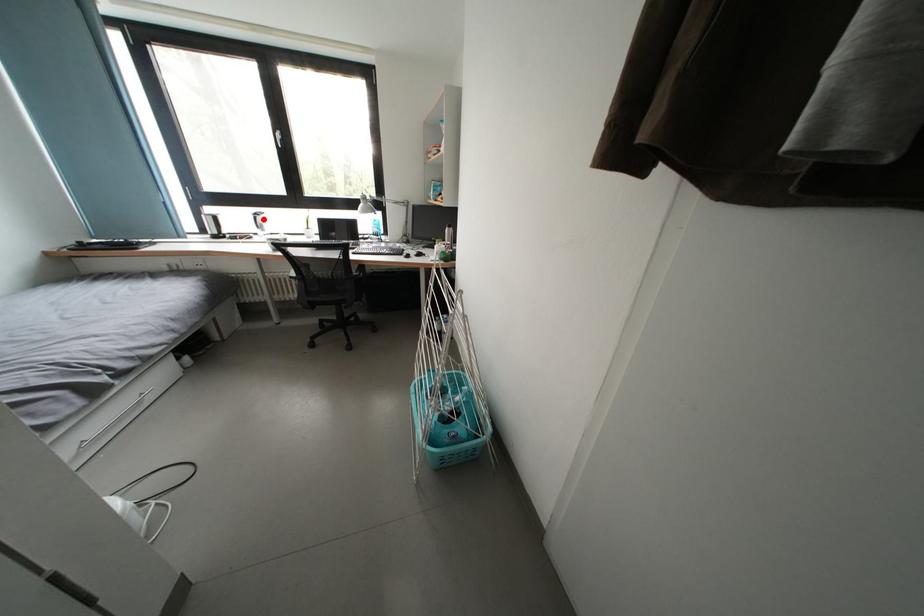
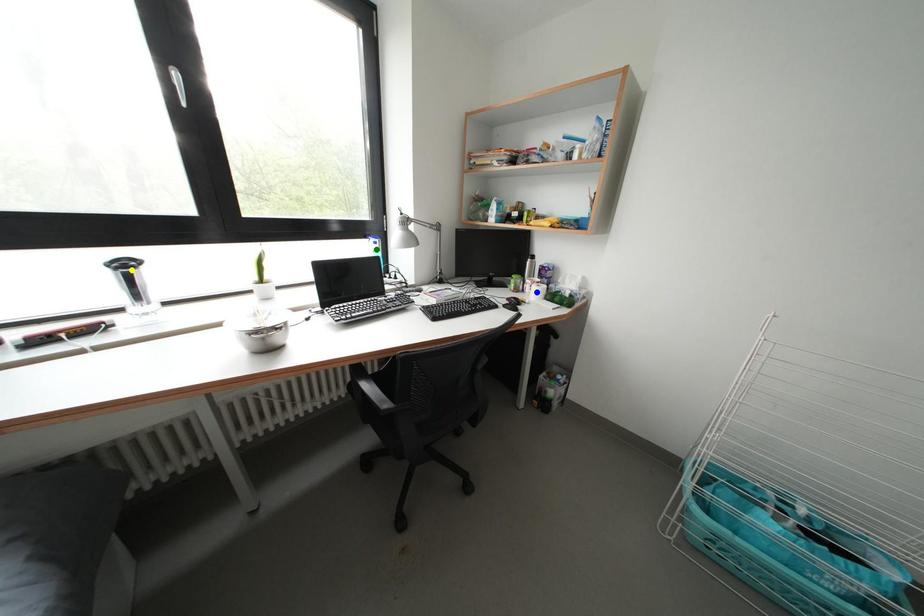
Question: I am providing you with two images of the same scene from different viewpoints. A red point is marked on the first image. You are given multiple points on the second image. In image 2, which mark is for the same physical point as the one in image 1?

Choices:
 (A) yellow point
 (B) blue point
 (C) green point

Answer: (A)